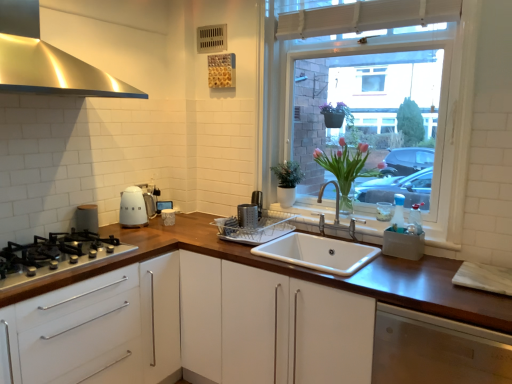
In order to click on free space to the left of silver metallic grater at center, which ranks as the 1th appliance in right-to-left order in this screenshot , I will do `click(207, 236)`.